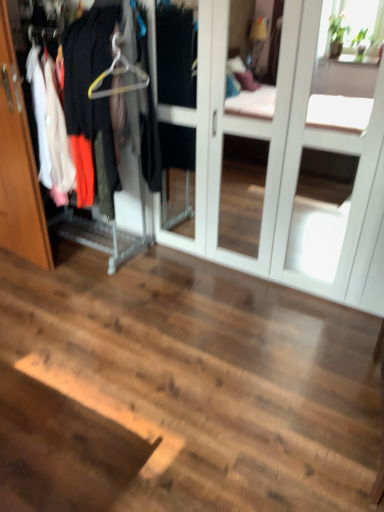
Where is `vacant space in front of white glossy screen door at center`? vacant space in front of white glossy screen door at center is located at coordinates (210, 361).